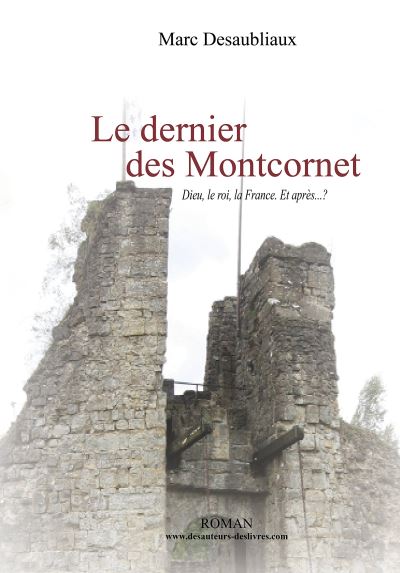
The width and height of the screenshot is (400, 573). Find the location of `door`. door is located at coordinates (223, 555).